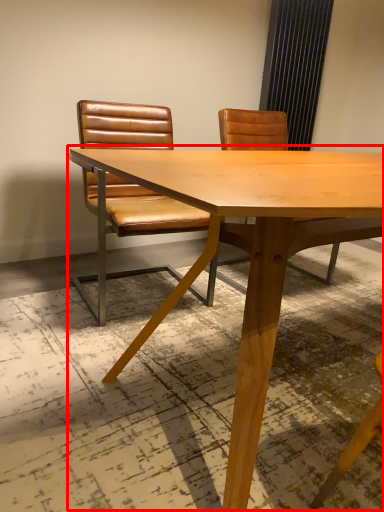
Question: From the image, what is the correct spatial relationship of table (annotated by the red box) in relation to chair?

Choices:
 (A) right
 (B) left

Answer: (A)